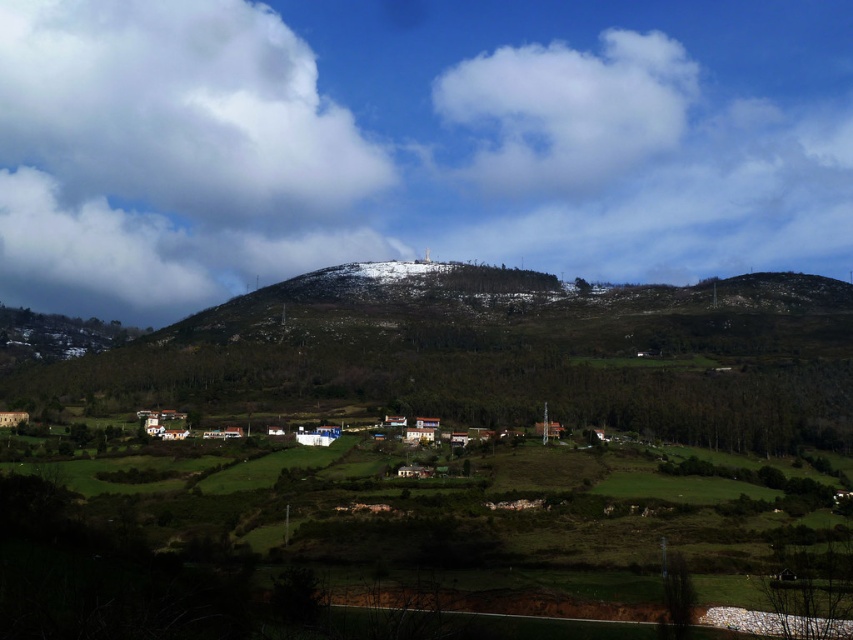
Question: Among these points, which one is nearest to the camera?

Choices:
 (A) (62, 307)
 (B) (676, 108)
 (C) (308, 196)

Answer: (C)

Question: Does white fluffy cloud at upper left appear over cloudy white cloud at upper left?

Choices:
 (A) no
 (B) yes

Answer: (B)

Question: Does white fluffy cloud at upper center appear on the left side of cloudy white cloud at upper left?

Choices:
 (A) yes
 (B) no

Answer: (B)

Question: Which of the following is the farthest from the observer?

Choices:
 (A) (526, 92)
 (B) (190, 179)

Answer: (A)

Question: Among these points, which one is nearest to the camera?

Choices:
 (A) (521, 182)
 (B) (27, 124)

Answer: (A)

Question: Is white fluffy cloud at upper left further to the viewer compared to white fluffy cloud at upper center?

Choices:
 (A) yes
 (B) no

Answer: (B)